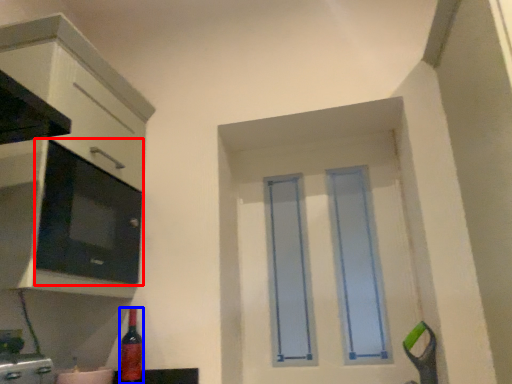
Question: Which object appears farthest to the camera in this image, appliance (highlighted by a red box) or bottle (highlighted by a blue box)?

Choices:
 (A) appliance
 (B) bottle

Answer: (B)